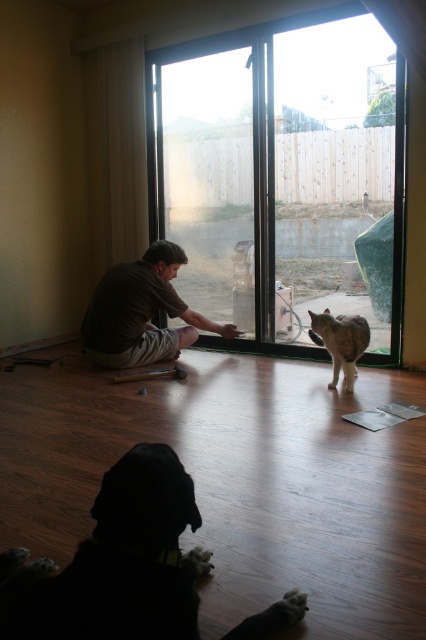
Is silhouette fur dog at lower left positioned before tabby fur cat at right?

Yes, it is in front of tabby fur cat at right.

Is silhouette fur dog at lower left smaller than tabby fur cat at right?

No.

This screenshot has width=426, height=640. Identify the location of silhouette fur dog at lower left. (115, 563).

Between brown cotton shirt at center and tabby fur cat at right, which one appears on the left side from the viewer's perspective?

brown cotton shirt at center

From the picture: Is brown cotton shirt at center wider than tabby fur cat at right?

Yes, brown cotton shirt at center is wider than tabby fur cat at right.

This screenshot has width=426, height=640. What do you see at coordinates (143, 312) in the screenshot?
I see `brown cotton shirt at center` at bounding box center [143, 312].

Find the location of a particular element. brown cotton shirt at center is located at coordinates (143, 312).

Consider the image. Between transparent glass door at center and tabby fur cat at right, which one appears on the left side from the viewer's perspective?

From the viewer's perspective, transparent glass door at center appears more on the left side.

Who is more forward, [347,275] or [342,317]?

Point [342,317] is in front.

Is point (273, 179) closer to viewer compared to point (350, 384)?

That is False.

Locate an element on the screen. The image size is (426, 640). transparent glass door at center is located at coordinates (284, 172).